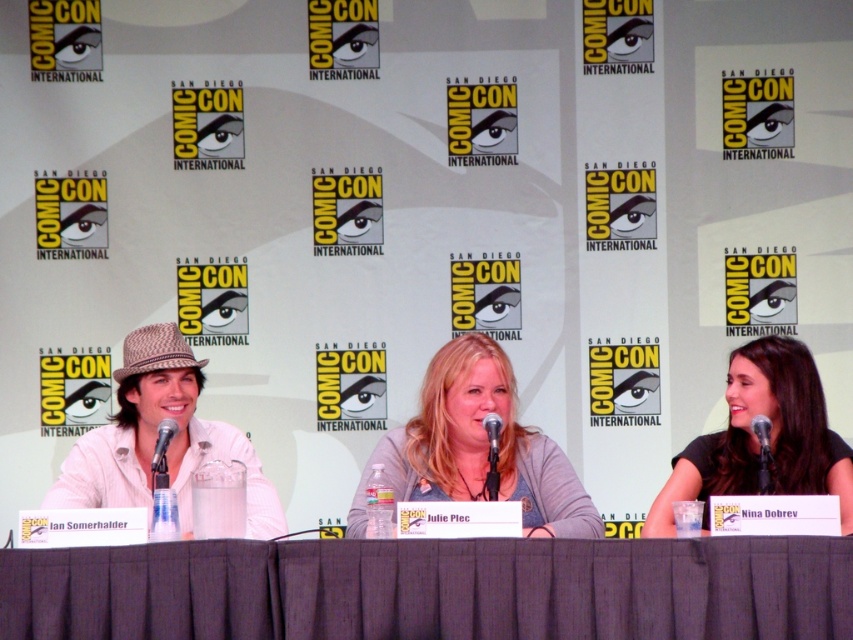
Is white woven hat at left above matte black microphone at center?

No, white woven hat at left is not above matte black microphone at center.

How distant is white woven hat at left from matte black microphone at center?

96.00 centimeters

Is point (125, 374) positioned before point (486, 428)?

No, (125, 374) is behind (486, 428).

The image size is (853, 640). What are the coordinates of `white woven hat at left` in the screenshot? It's located at (155, 436).

Is gray cotton shirt at center smaller than black matte shirt at right?

Actually, gray cotton shirt at center might be larger than black matte shirt at right.

Between gray cotton shirt at center and black matte shirt at right, which one has less height?

Standing shorter between the two is gray cotton shirt at center.

Between point (476, 493) and point (664, 513), which one is positioned behind?

The point (476, 493) is more distant.

Where is `gray cotton shirt at center`? gray cotton shirt at center is located at coordinates (477, 448).

Which of these two, gray cotton shirt at center or white woven hat at left, stands shorter?

gray cotton shirt at center is shorter.

Is gray cotton shirt at center to the left of white woven hat at left from the viewer's perspective?

In fact, gray cotton shirt at center is to the right of white woven hat at left.

Between point (570, 481) and point (190, 461), which one is positioned behind?

The point (190, 461) is more distant.

The image size is (853, 640). I want to click on gray cotton shirt at center, so click(477, 448).